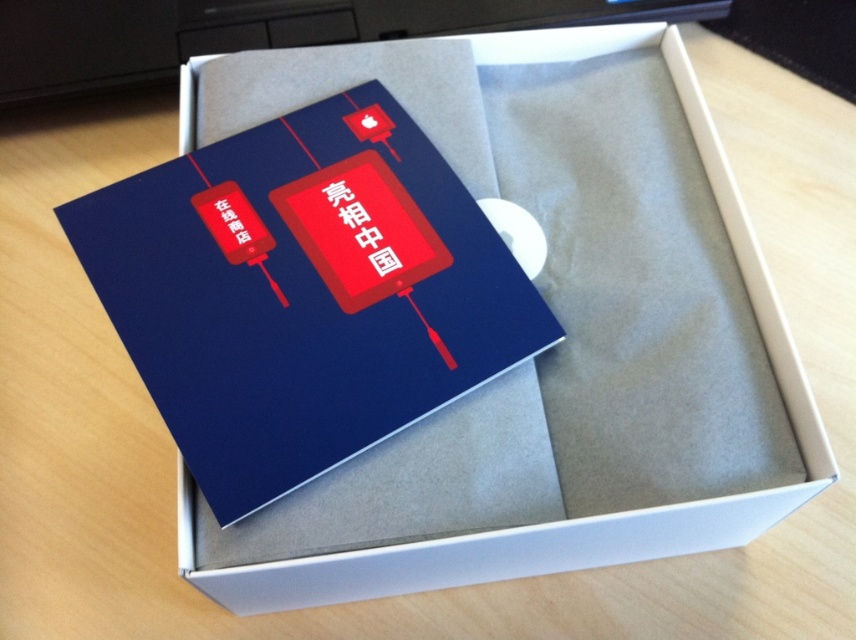
Is point (407, 460) positioned before point (321, 160)?

Yes.

Can you confirm if blue cardboard box at center is bigger than matte blue card at center?

Correct, blue cardboard box at center is larger in size than matte blue card at center.

Who is more forward, (550, 116) or (132, 324)?

Point (132, 324) is more forward.

The image size is (856, 640). In order to click on blue cardboard box at center in this screenshot , I will do (x=556, y=346).